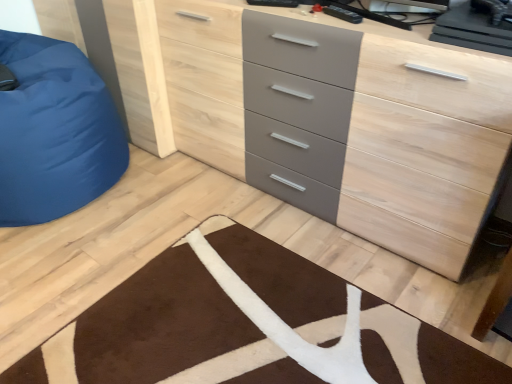
This screenshot has height=384, width=512. I want to click on free point above brown plush rug at lower center (from a real-world perspective), so click(x=240, y=319).